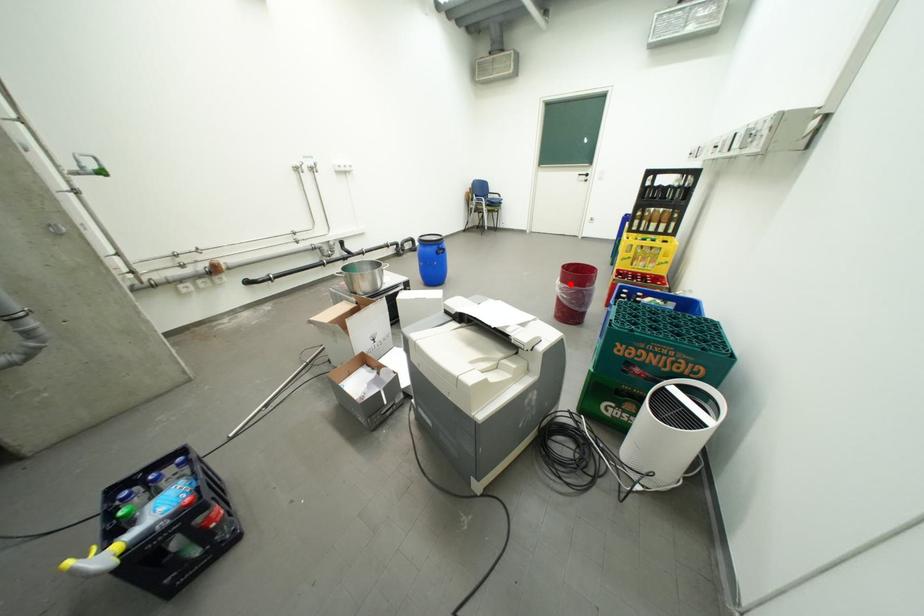
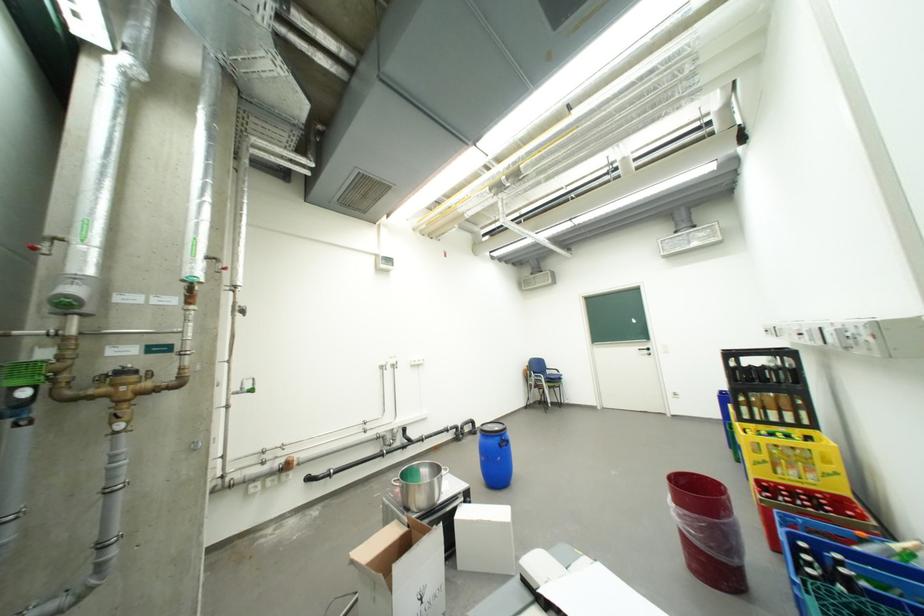
Question: I am providing you with two images of the same scene from different viewpoints. Image1 has a red point marked. In image2, the corresponding 3D location appears at what relative position? Reply with the corresponding letter.

Choices:
 (A) Closer
 (B) Farther

Answer: (B)